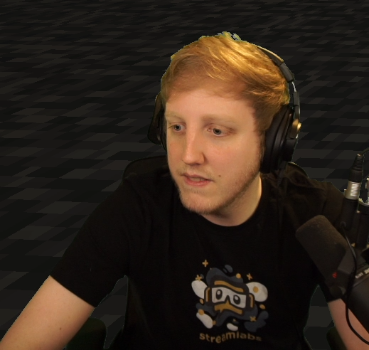
Locate an element on the screen. The height and width of the screenshot is (350, 369). headphones is located at coordinates (299, 131).